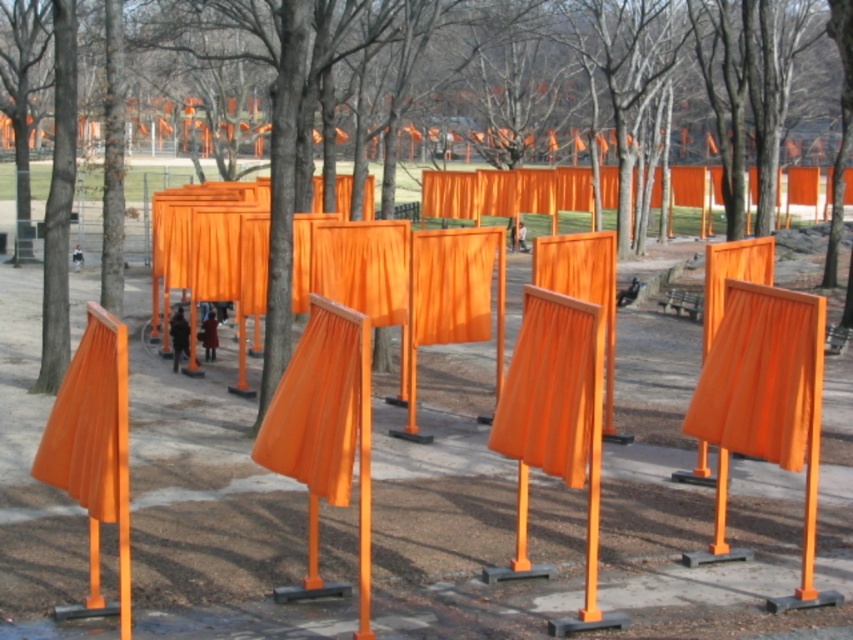
From the picture: Between orange matte curtain at center and matte wood curtain at center, which one is positioned higher?

matte wood curtain at center

Describe the element at coordinates (762, 376) in the screenshot. I see `orange matte curtain at center` at that location.

This screenshot has height=640, width=853. I want to click on orange matte curtain at center, so click(x=762, y=376).

The width and height of the screenshot is (853, 640). Identify the location of orange matte curtain at center. (762, 376).

Who is taller, orange matte curtain at center or orange matte fabric at center?

orange matte fabric at center

Between orange matte curtain at center and orange matte fabric at center, which one appears on the right side from the viewer's perspective?

orange matte curtain at center is more to the right.

The width and height of the screenshot is (853, 640). Describe the element at coordinates (762, 376) in the screenshot. I see `orange matte curtain at center` at that location.

Where is `orange matte curtain at center`? orange matte curtain at center is located at coordinates (762, 376).

Who is more distant from viewer, (515,413) or (105,470)?

The point (515,413) is more distant.

Which is more to the left, matte orange curtain at center or matte orange curtain at left?

matte orange curtain at left is more to the left.

Which is in front, point (589, 381) or point (41, 481)?

Point (589, 381) is in front.

I want to click on matte orange curtain at center, so pyautogui.click(x=552, y=387).